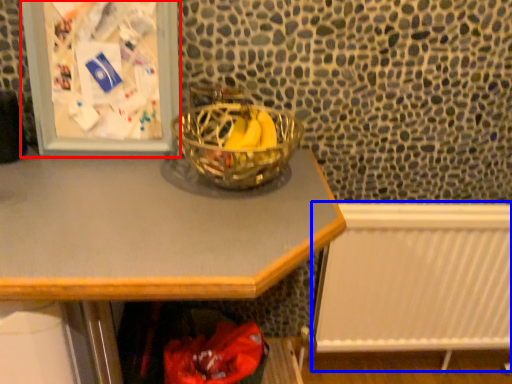
Question: Which object appears closest to the camera in this image, picture frame (highlighted by a red box) or radiator (highlighted by a blue box)?

Choices:
 (A) picture frame
 (B) radiator

Answer: (A)